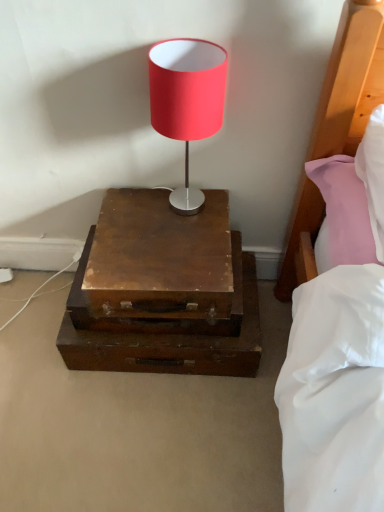
Question: Is wooden drawer at center oriented away from matte red lampshade at center?

Choices:
 (A) yes
 (B) no

Answer: (B)

Question: From a real-world perspective, is wooden drawer at center positioned over matte red lampshade at center based on gravity?

Choices:
 (A) no
 (B) yes

Answer: (A)

Question: Is wooden drawer at center aimed at matte red lampshade at center?

Choices:
 (A) no
 (B) yes

Answer: (A)

Question: Is wooden drawer at center thinner than matte red lampshade at center?

Choices:
 (A) yes
 (B) no

Answer: (B)

Question: Can you confirm if wooden drawer at center is wider than matte red lampshade at center?

Choices:
 (A) no
 (B) yes

Answer: (B)

Question: Is point (168, 118) positioned closer to the camera than point (137, 334)?

Choices:
 (A) farther
 (B) closer

Answer: (B)

Question: From a real-world perspective, is matte red lampshade at center above or below wooden nightstand at center?

Choices:
 (A) above
 (B) below

Answer: (A)

Question: Which is correct: matte red lampshade at center is inside wooden nightstand at center, or outside of it?

Choices:
 (A) outside
 (B) inside

Answer: (A)

Question: From the image's perspective, is matte red lampshade at center located above or below wooden nightstand at center?

Choices:
 (A) below
 (B) above

Answer: (B)

Question: Considering their positions, is wooden nightstand at center located in front of or behind matte red lampshade at center?

Choices:
 (A) behind
 (B) front

Answer: (A)

Question: Is wooden nightstand at center bigger or smaller than matte red lampshade at center?

Choices:
 (A) big
 (B) small

Answer: (A)

Question: From the image's perspective, is wooden nightstand at center positioned above or below matte red lampshade at center?

Choices:
 (A) above
 (B) below

Answer: (B)

Question: From a real-world perspective, relative to matte red lampshade at center, is wooden nightstand at center vertically above or below?

Choices:
 (A) below
 (B) above

Answer: (A)

Question: Is point tap(84, 313) closer or farther from the camera than point tap(223, 206)?

Choices:
 (A) closer
 (B) farther

Answer: (A)

Question: From a real-world perspective, is wooden drawer at center physically located above or below wooden nightstand at center?

Choices:
 (A) above
 (B) below

Answer: (A)